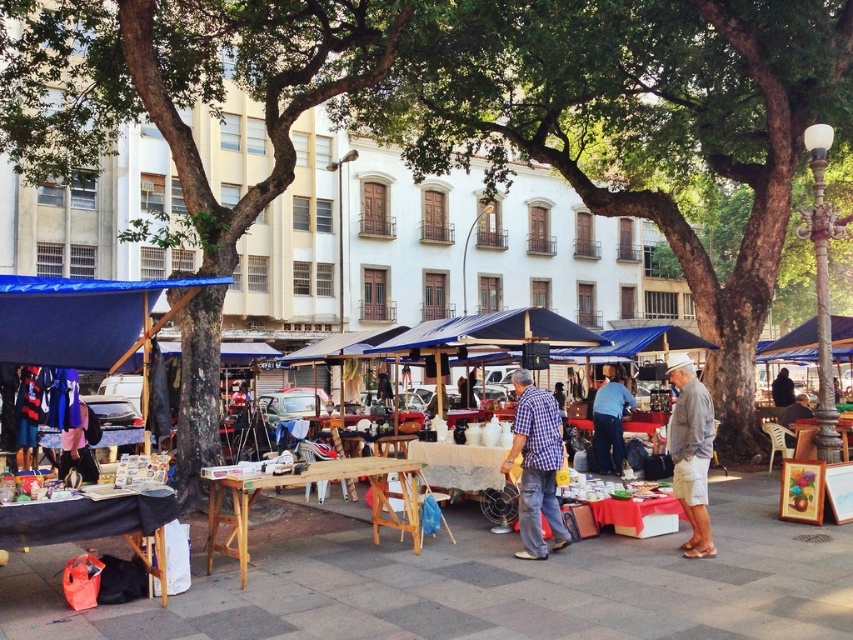
Question: Does green leafy tree at center have a larger size compared to checkered fabric shirt at center?

Choices:
 (A) no
 (B) yes

Answer: (B)

Question: Which of the following is the closest to the observer?

Choices:
 (A) coord(781,385)
 (B) coord(129,339)
 (C) coord(461,28)

Answer: (B)

Question: Does checkered fabric shirt at center appear over blue fabric bag at center?

Choices:
 (A) no
 (B) yes

Answer: (B)

Question: Considering the real-world distances, which object is farthest from the green leafy tree at center?

Choices:
 (A) blue fabric bag at center
 (B) dark brown leather jacket at lower right
 (C) gray cotton shirt at center
 (D) checkered fabric shirt at center

Answer: (D)

Question: Among these points, which one is farthest from the camera?

Choices:
 (A) (38, 54)
 (B) (686, 552)

Answer: (A)

Question: Can you confirm if green leafy tree at left is thinner than blue fabric bag at center?

Choices:
 (A) yes
 (B) no

Answer: (B)